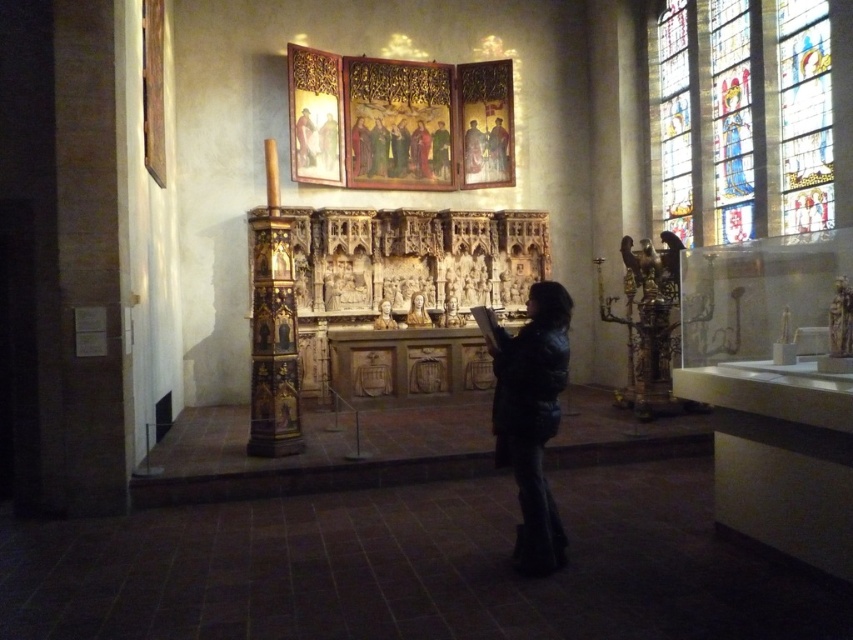
You are standing in front of the altar and want to touch the point at coordinate [669,60]. If your arm can reach up to 1.2 meters, can you reach it?

The point at coordinate [669,60] is 11.97 meters away from the viewer, which is much farther than the arm reach of 1.2 meters. You cannot reach it.

You are an art conservator examining the altar. You need to place a protective cloth over the black leather jacket at center and the matte wooden figure at upper center. Which object should you cover first if you want to start with the one closer to the edge of the altar?

The black leather jacket at center is to the right of the matte wooden figure at upper center, so it is closer to the edge of the altar. You should cover the black leather jacket at center first.